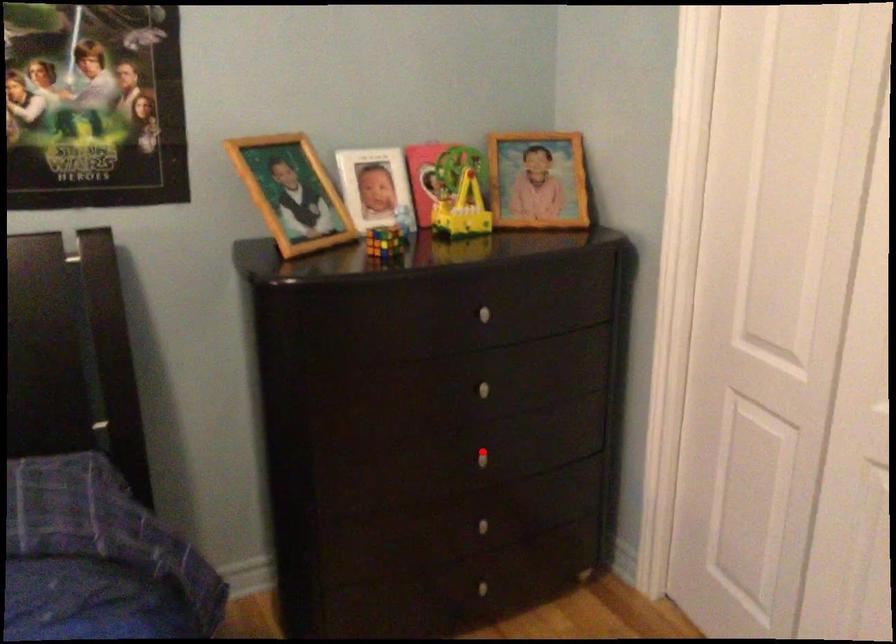
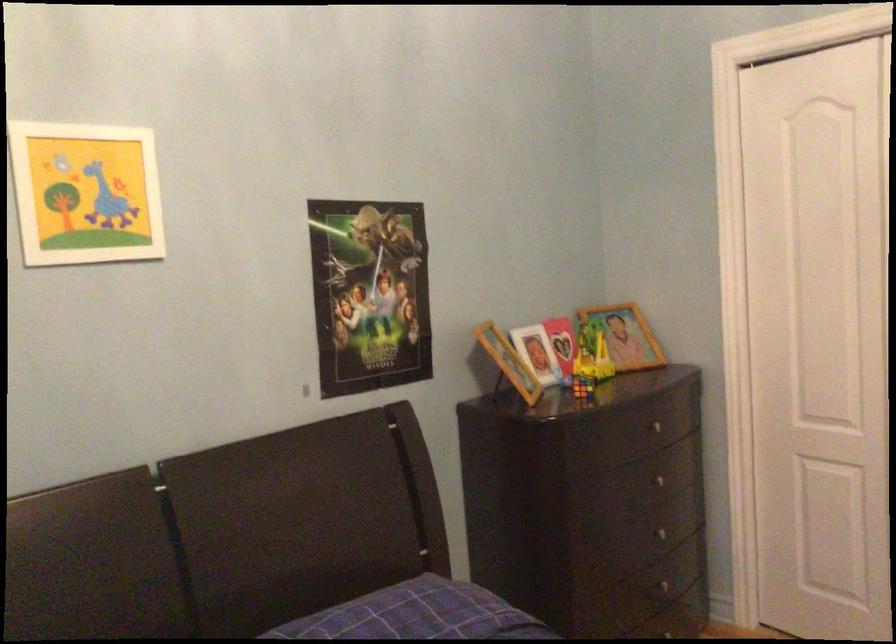
Question: I am providing you with two images of the same scene from different viewpoints. In image1, a red point is highlighted. Considering the same 3D point in image2, which of the following is correct?

Choices:
 (A) It is closer
 (B) It is farther

Answer: (B)